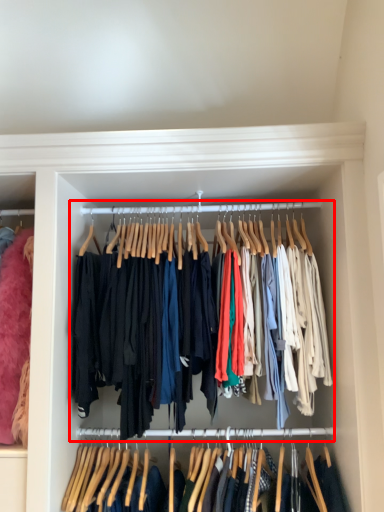
Question: From the image's perspective, considering the relative positions of closet (annotated by the red box) and closet in the image provided, where is closet (annotated by the red box) located with respect to the staircase?

Choices:
 (A) above
 (B) below

Answer: (A)